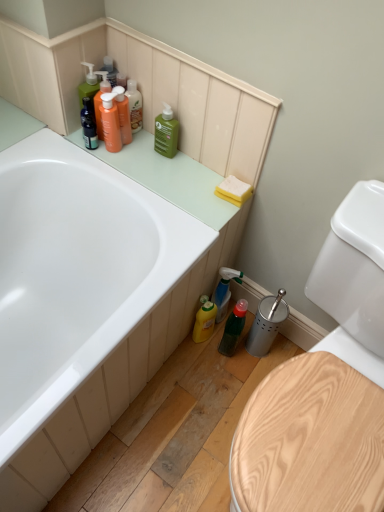
Image resolution: width=384 pixels, height=512 pixels. I want to click on free space in front of translucent orange bottle at upper left, the 2th toiletry ordered from the bottom, so click(134, 160).